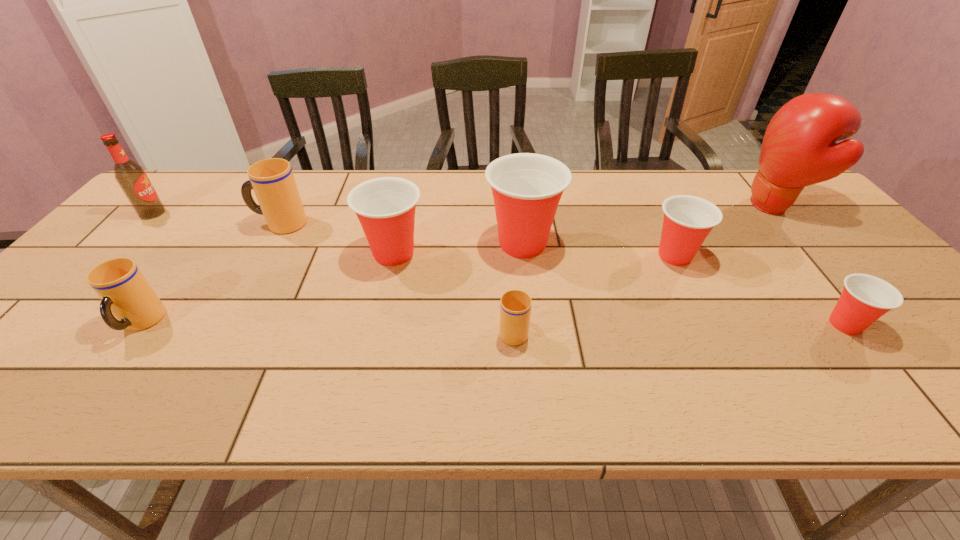
This screenshot has width=960, height=540. Identify the location of the second smallest red cup. pyautogui.click(x=688, y=220).

At what (x,y) coordinates should I click in order to perform the action: click on the second biggest beige cup. Please return your answer as a coordinate pair (x, y). Looking at the image, I should click on (125, 292).

Find the location of a particular element. The width and height of the screenshot is (960, 540). the eighth object from right to left is located at coordinates [125, 292].

Find the location of a particular element. This screenshot has height=540, width=960. the nearest red cup is located at coordinates (865, 298).

Locate an element on the screen. This screenshot has width=960, height=540. the rightmost red cup is located at coordinates (865, 298).

Locate an element on the screen. the rightmost beige cup is located at coordinates (515, 306).

This screenshot has height=540, width=960. In order to click on free region located on the striking surface of the tallest object in this screenshot , I will do `click(672, 206)`.

Identify the location of blank area located on the striking surface of the tallest object. (659, 206).

You are a GUI agent. You are given a task and a screenshot of the screen. Output one action in this format:
    pyautogui.click(x=<x>, y=<y>)
    Task: Click on the vacant space located 0.100m on the striking surface of the tallest object
    
    Given the screenshot: What is the action you would take?
    pyautogui.click(x=708, y=206)

Identify the location of vacant space located 0.090m on the right of the beer bottle. This screenshot has width=960, height=540. (195, 213).